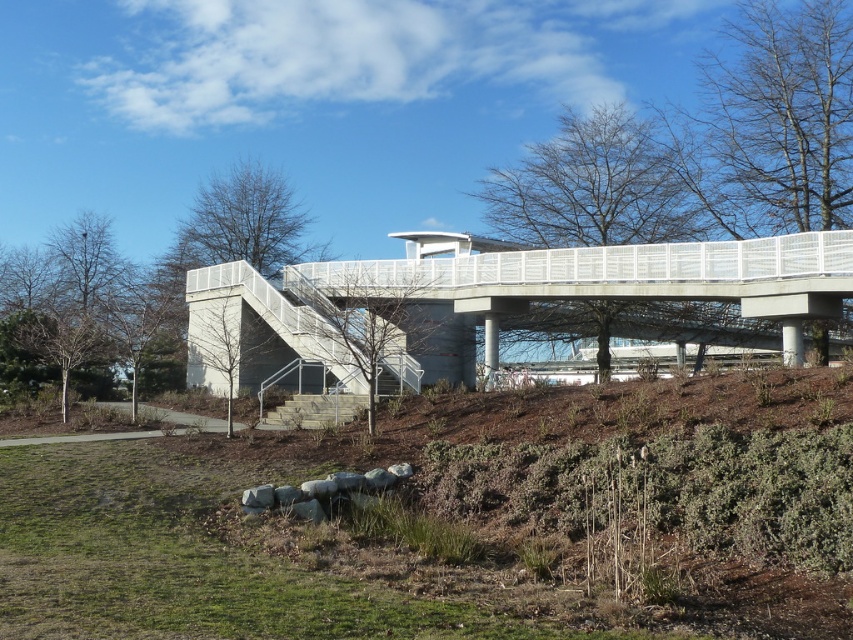
Which is above, white metallic pedestrian bridge at center or wooden stairs at center?

white metallic pedestrian bridge at center

Is white metallic pedestrian bridge at center above wooden stairs at center?

Correct, white metallic pedestrian bridge at center is located above wooden stairs at center.

Is point (738, 248) less distant than point (312, 413)?

No, (738, 248) is behind (312, 413).

Locate an element on the screen. This screenshot has height=640, width=853. white metallic pedestrian bridge at center is located at coordinates (498, 301).